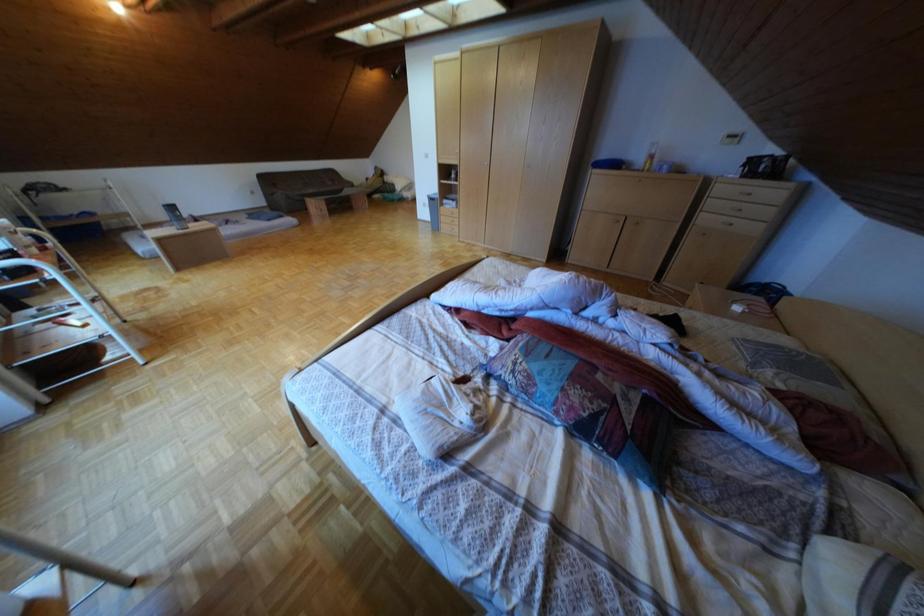
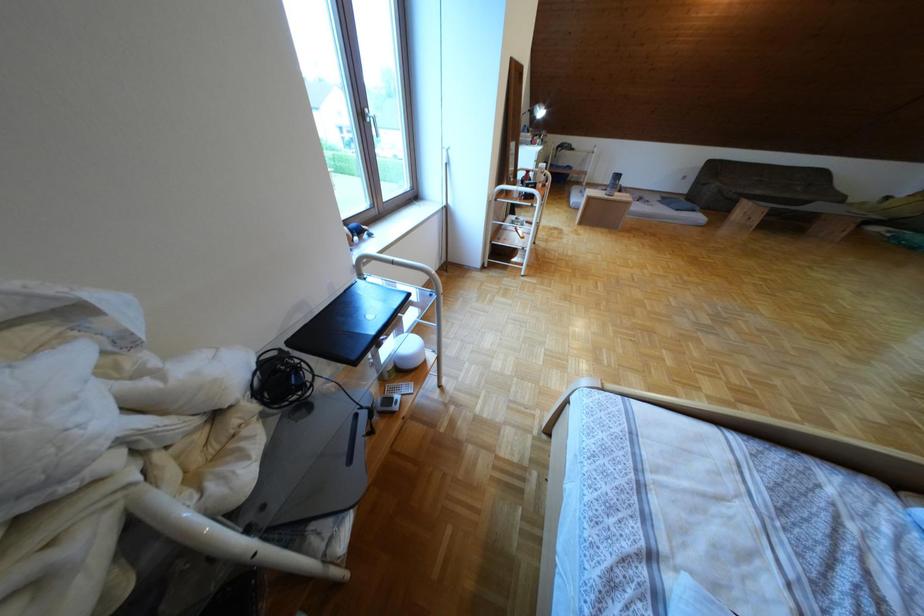
The images are taken continuously from a first-person perspective. In which direction is your viewpoint rotating?

The camera's rotation is toward left-down.